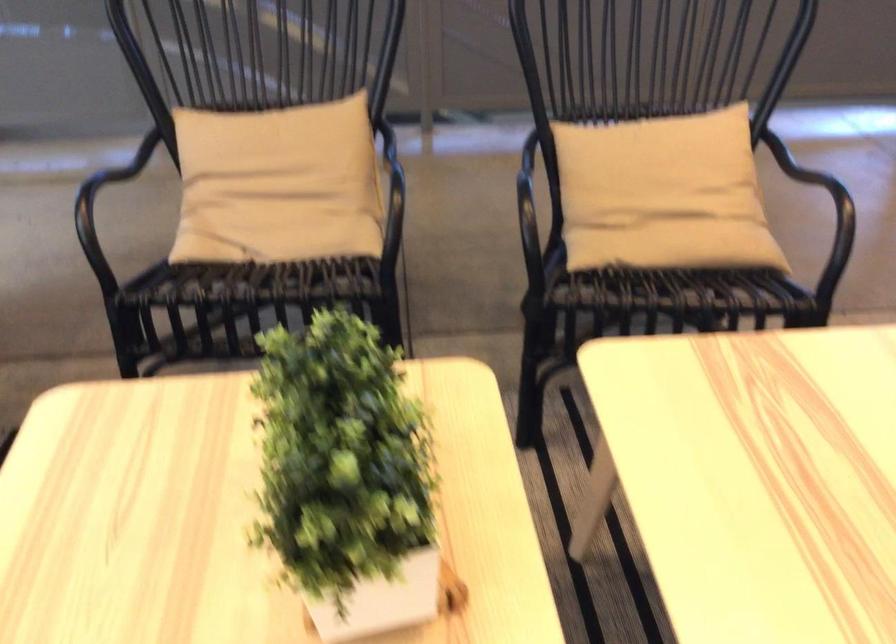
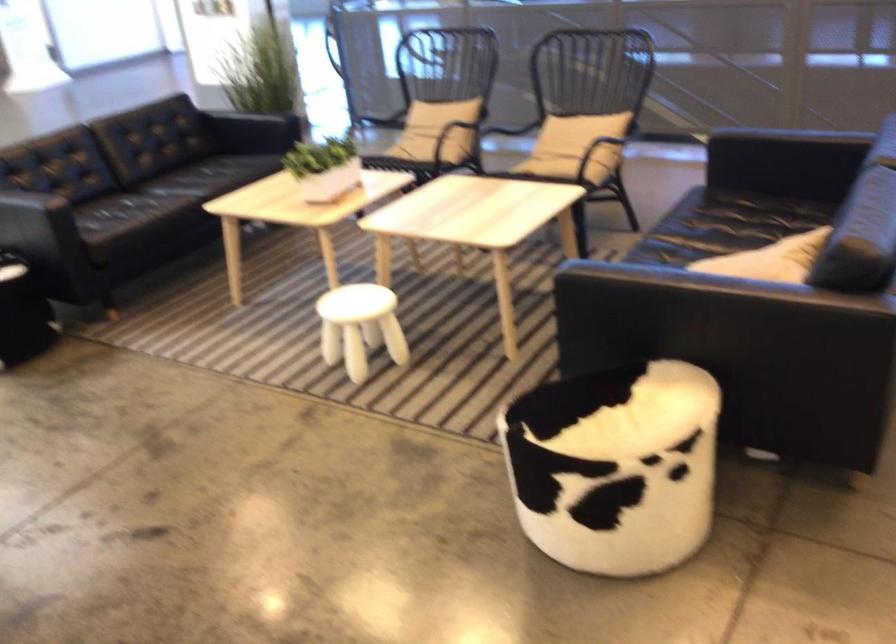
Locate, in the second image, the point that corresponds to point (364, 194) in the first image.

(440, 128)